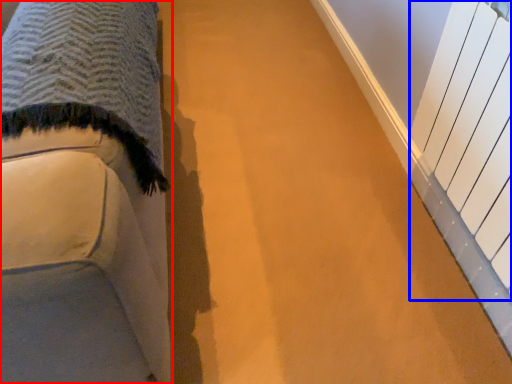
Question: Which point is further to the camera, furniture (highlighted by a red box) or radiator (highlighted by a blue box)?

Choices:
 (A) furniture
 (B) radiator

Answer: (B)